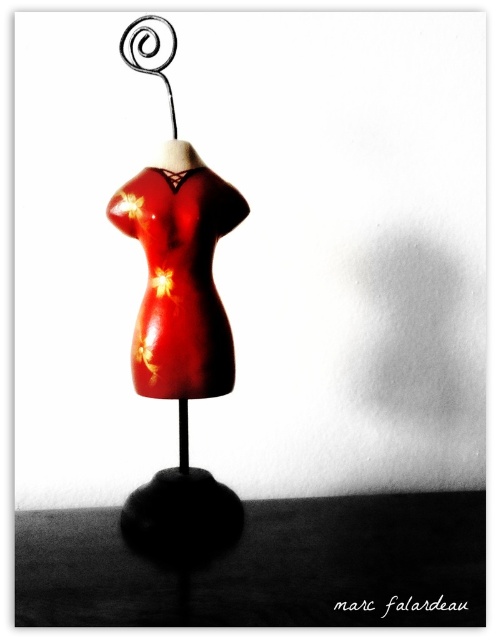
Question: Does glossy red dress at center have a lesser width compared to spiral wire hanger at upper center?

Choices:
 (A) yes
 (B) no

Answer: (B)

Question: Which point is farther to the camera?

Choices:
 (A) spiral wire hanger at upper center
 (B) glossy red dress at center

Answer: (A)

Question: Is the position of glossy red dress at center less distant than that of spiral wire hanger at upper center?

Choices:
 (A) yes
 (B) no

Answer: (A)

Question: Does glossy red dress at center appear on the right side of spiral wire hanger at upper center?

Choices:
 (A) yes
 (B) no

Answer: (A)